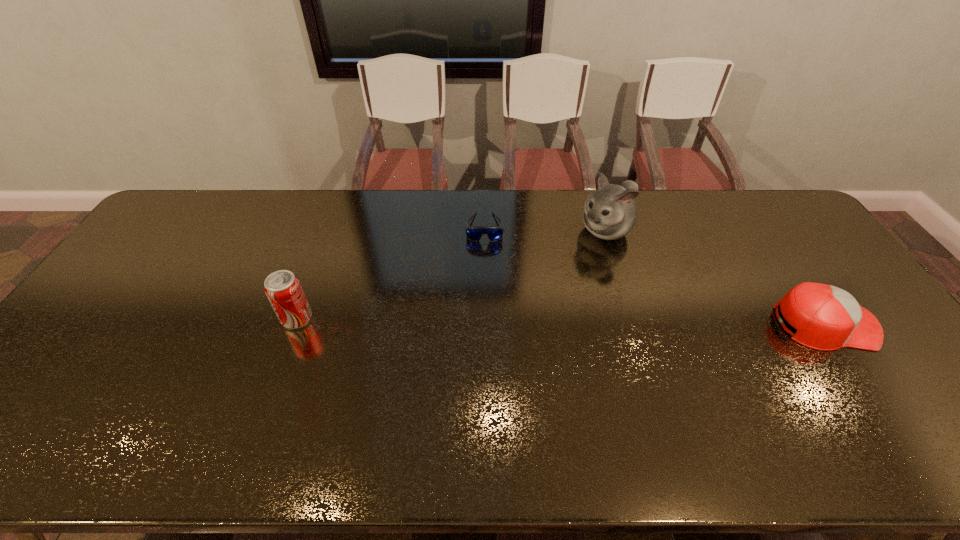
Locate an element on the screen. the third shortest object is located at coordinates (282, 288).

At what (x,y) coordinates should I click in order to perform the action: click on the leftmost object. Please return your answer as a coordinate pair (x, y). Looking at the image, I should click on (282, 288).

Identify the location of baseball cap. (826, 318).

The image size is (960, 540). Find the location of `the second shortest object`. the second shortest object is located at coordinates (826, 318).

The height and width of the screenshot is (540, 960). I want to click on the second object from right to left, so pos(610,213).

Identify the location of the tallest object. (610, 213).

This screenshot has width=960, height=540. Identify the location of the shortest object. (474, 233).

You are a GUI agent. You are given a task and a screenshot of the screen. Output one action in this format:
    pyautogui.click(x=<x>, y=<y>)
    Task: Click on the second object from left to right
    
    Given the screenshot: What is the action you would take?
    pyautogui.click(x=474, y=233)

You are a GUI agent. You are given a task and a screenshot of the screen. Output one action in this format:
    pyautogui.click(x=<x>, y=<y>)
    Task: Click on the free point located 0.380m on the right of the leftmost object
    The height and width of the screenshot is (540, 960).
    Given the screenshot: What is the action you would take?
    pyautogui.click(x=449, y=318)

Identify the location of free location located on the face of the hamster. The width and height of the screenshot is (960, 540). (525, 300).